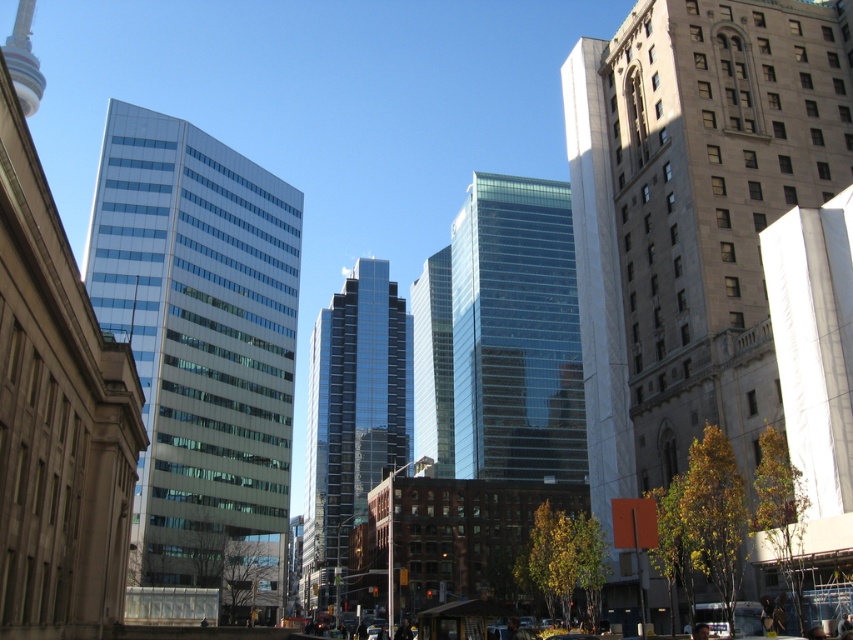
Question: Which point is closer to the camera?

Choices:
 (A) shiny glass skyscraper at center
 (B) transparent glass building at center

Answer: (A)

Question: Does shiny glass skyscraper at center appear on the left side of glassy reflective skyscraper at center?

Choices:
 (A) yes
 (B) no

Answer: (A)

Question: Is matte glass building at left above shiny glass skyscraper at center?

Choices:
 (A) yes
 (B) no

Answer: (A)

Question: Which object is the closest to the transparent glass building at center?

Choices:
 (A) white marble skyscraper at center
 (B) shiny glass skyscraper at center
 (C) matte glass building at left
 (D) glassy reflective skyscraper at center

Answer: (D)

Question: Which point is farther to the camera?

Choices:
 (A) pos(173,259)
 (B) pos(552,410)
 (C) pos(339,301)
 (D) pos(608,497)

Answer: (C)

Question: Can you confirm if transparent glass building at center is bigger than glassy reflective skyscraper at center?

Choices:
 (A) no
 (B) yes

Answer: (B)